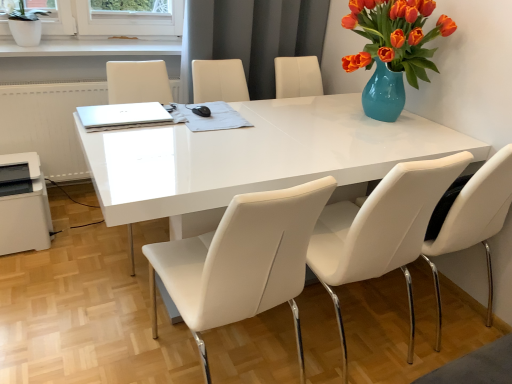
You are a GUI agent. You are given a task and a screenshot of the screen. Output one action in this format:
    pyautogui.click(x=<x>, y=<y>)
    Task: Click on the vacant space to the left of white leather chair at center, positioned as the 3th chair in right-to-left order
    The image size is (512, 384).
    Given the screenshot: What is the action you would take?
    pyautogui.click(x=105, y=334)